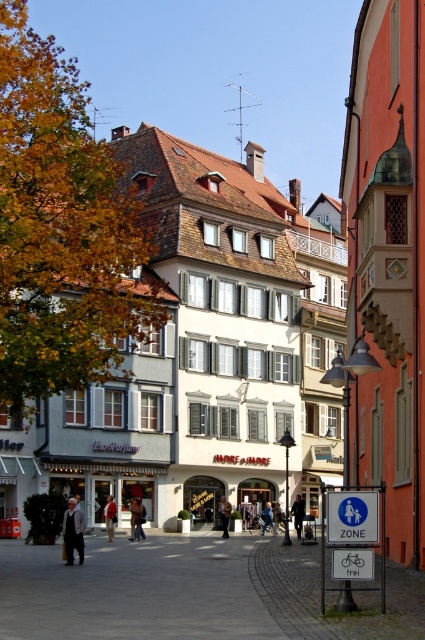
You are a customer looking for a jacket to try on. You see a red leather jacket at center and a blue denim jacket at center. Which jacket is positioned higher on the rack?

The red leather jacket at center is above the blue denim jacket at center, so it is positioned higher on the rack.

You are a tailor standing in the street and want to know if the dark gray suit at center can fit into a storage box designed for the brown leather jacket at center. Can it fit?

The dark gray suit at center might be wider than brown leather jacket at center, so it may not fit into the storage box designed for the brown leather jacket at center.

You are a tailor observing the dark gray suit at center and the brown leather jacket at center in the European street scene. Which clothing item is taller?

The dark gray suit at center is taller than the brown leather jacket at center.